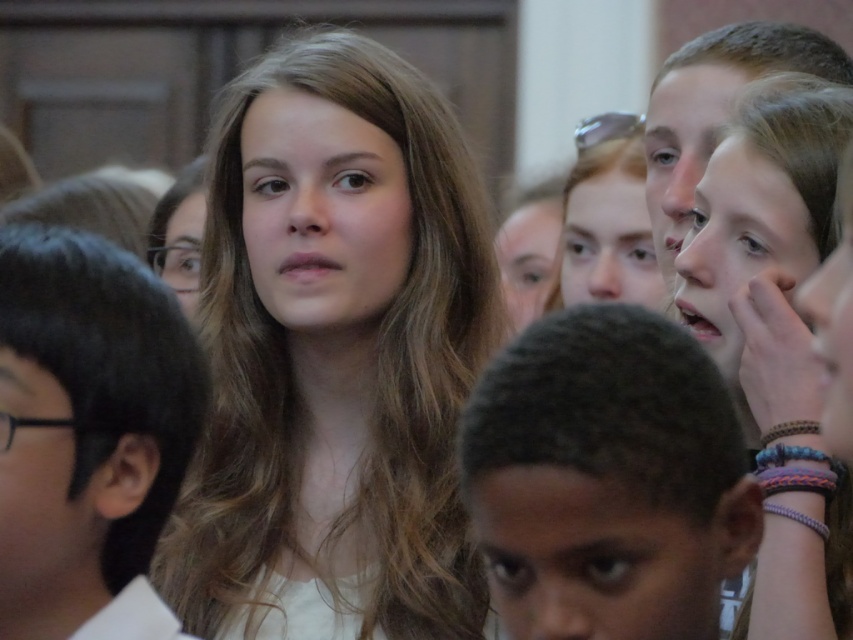
Question: Which object appears farthest from the camera in this image?

Choices:
 (A) black hair at center
 (B) smooth brown hair at center

Answer: (B)

Question: Among these points, which one is nearest to the camera?

Choices:
 (A) (349, 477)
 (B) (96, 452)

Answer: (B)

Question: Observing the image, what is the correct spatial positioning of smooth brown hair at center in reference to dark brown hair at center?

Choices:
 (A) below
 (B) above

Answer: (B)

Question: Does smooth brown hair at center have a larger size compared to dark brown hair at center?

Choices:
 (A) no
 (B) yes

Answer: (B)

Question: Which point is closer to the camera?

Choices:
 (A) black hair at center
 (B) smooth brown hair at center
 (C) dark brown hair at center

Answer: (C)

Question: Does dark brown hair at center come behind black hair at center?

Choices:
 (A) yes
 (B) no

Answer: (B)